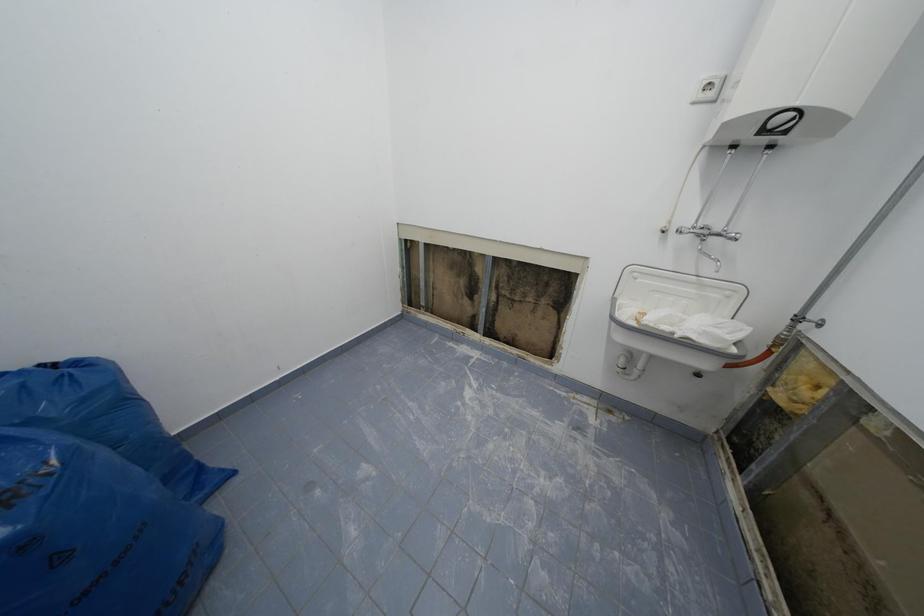
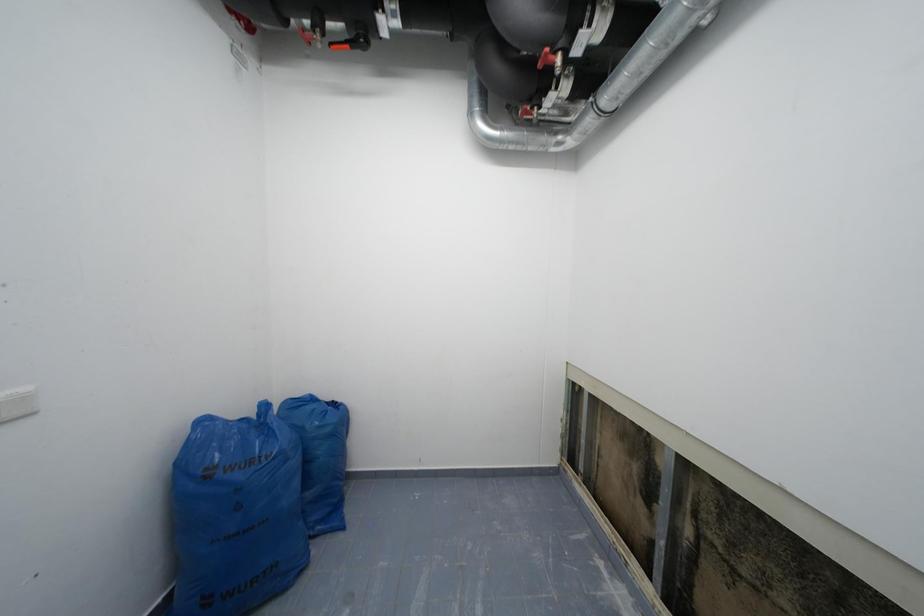
Question: The camera is either moving clockwise (left) or counter-clockwise (right) around the object. The first image is from the beginning of the video and the second image is from the end. Is the camera moving left or right when shooting the video?

Choices:
 (A) Left
 (B) Right

Answer: (B)